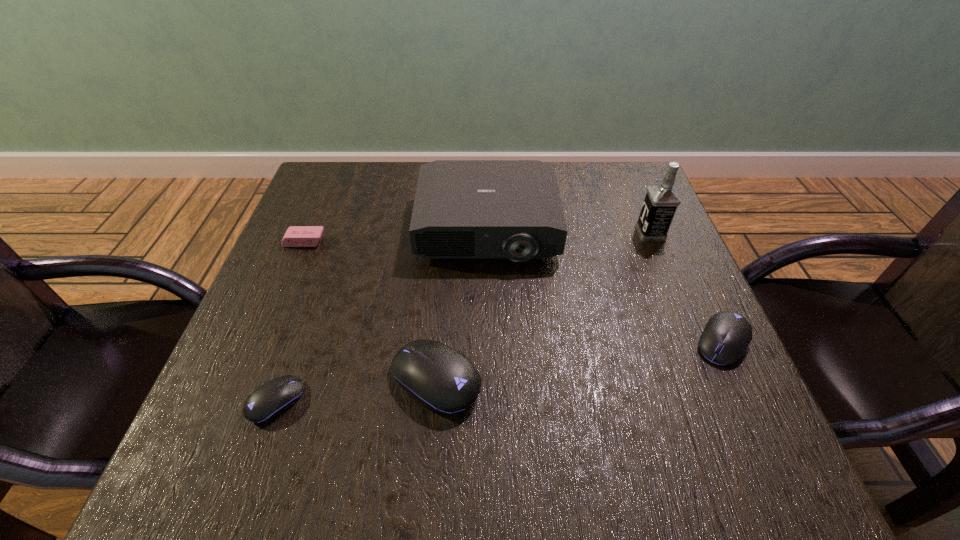
Choose which computer mouse is the nearest neighbor to the tallest object. Please provide its 2D coordinates. Your answer should be formatted as a tuple, i.e. [(x, y)], where the tuple contains the x and y coordinates of a point satisfying the conditions above.

[(726, 336)]

Identify the location of vacant region that satisfies the following two spatial constraints: 1. on the front label of the tallest object; 2. on the left side of the second tallest computer mouse. (695, 342).

At what (x,y) coordinates should I click in order to perform the action: click on vacant area in the image that satisfies the following two spatial constraints: 1. on the front label of the vodka; 2. on the front side of the third tallest object. Please return your answer as a coordinate pair (x, y). Looking at the image, I should click on (710, 380).

Identify the location of free space that satisfies the following two spatial constraints: 1. on the front side of the eraser; 2. on the right side of the third shortest object. The width and height of the screenshot is (960, 540). (263, 342).

Image resolution: width=960 pixels, height=540 pixels. Find the location of `free space that satisfies the following two spatial constraints: 1. on the front side of the third shortest object; 2. on the left side of the eraser`. free space that satisfies the following two spatial constraints: 1. on the front side of the third shortest object; 2. on the left side of the eraser is located at coordinates (263, 342).

You are a GUI agent. You are given a task and a screenshot of the screen. Output one action in this format:
    pyautogui.click(x=<x>, y=<y>)
    Task: Click on the free point that satisfies the following two spatial constraints: 1. on the front label of the tallest object; 2. on the front side of the eraser
    This screenshot has height=540, width=960.
    Given the screenshot: What is the action you would take?
    pyautogui.click(x=654, y=241)

Identify the location of free spot that satisfies the following two spatial constraints: 1. on the back side of the rightmost computer mouse; 2. on the front label of the tallest object. (672, 233).

The image size is (960, 540). Identify the location of vacant position in the image that satisfies the following two spatial constraints: 1. on the front side of the second tallest computer mouse; 2. on the right side of the eraser. (263, 342).